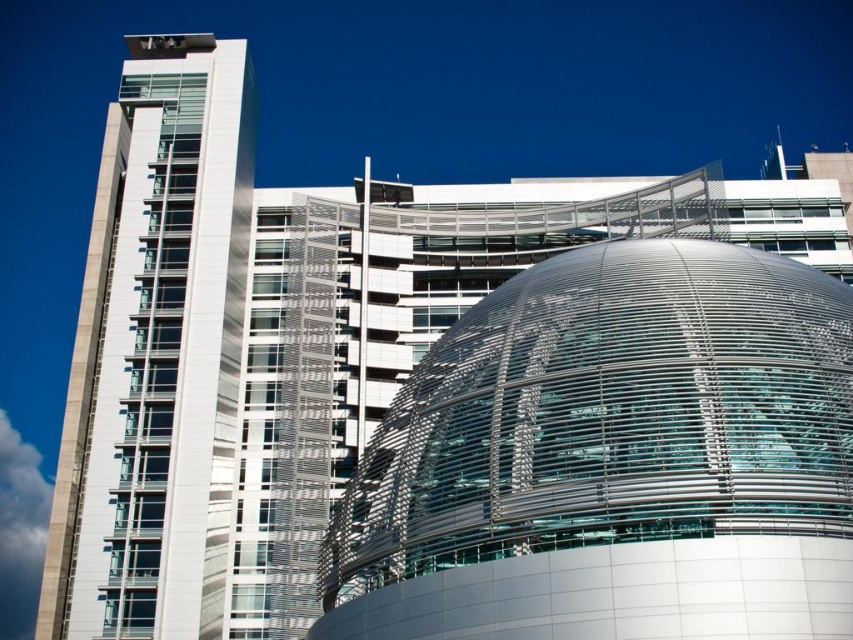
You are an architect evaluating the building design. Based on the scene, which object is shorter between the transparent glass dome at center and the white glass building at left?

The transparent glass dome at center is shorter than the white glass building at left.

You are a drone operator who needs to fly a drone between the transparent glass dome at center and the white glass building at left. The drone has a wingspan of 8 feet. Is there enough space for the drone to pass through the gap between them?

The distance between the transparent glass dome at center and the white glass building at left is 90.30 feet. Since the drone has a wingspan of 8 feet, there is ample space for it to pass through the gap safely.

You are standing at the entrance of the modern architectural structure. You notice a point marked at coordinates (612,458). What does this point indicate in the scene?

The point at coordinates (612,458) marks the transparent glass dome at center.